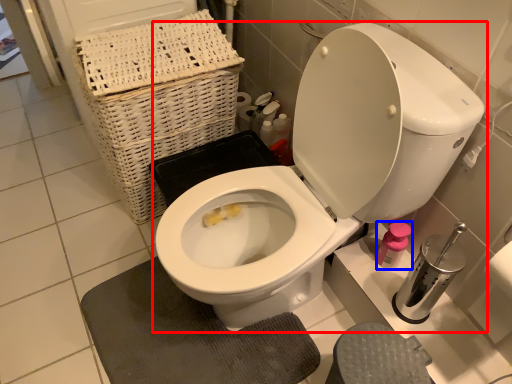
Question: Which object is further to the camera taking this photo, toilet (highlighted by a red box) or toiletry (highlighted by a blue box)?

Choices:
 (A) toilet
 (B) toiletry

Answer: (B)